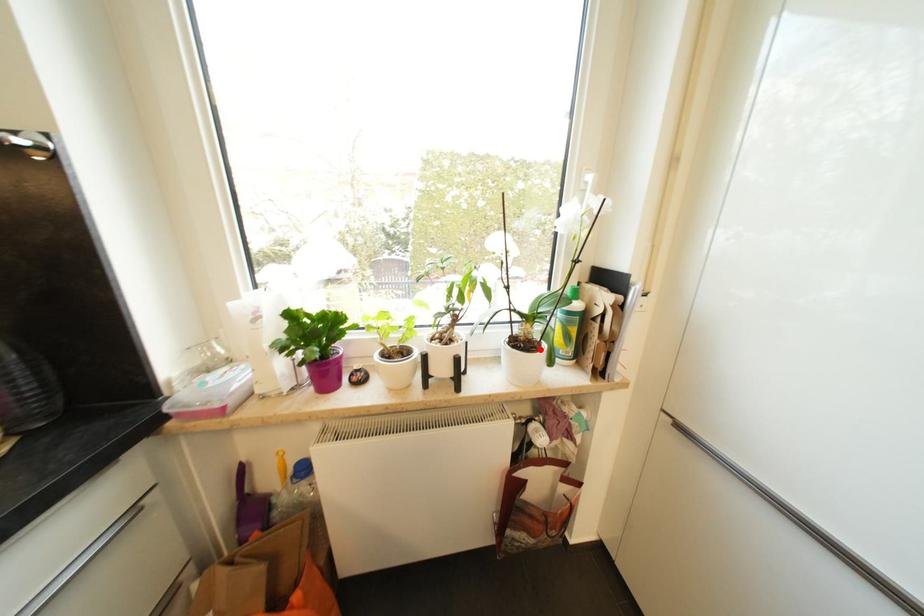
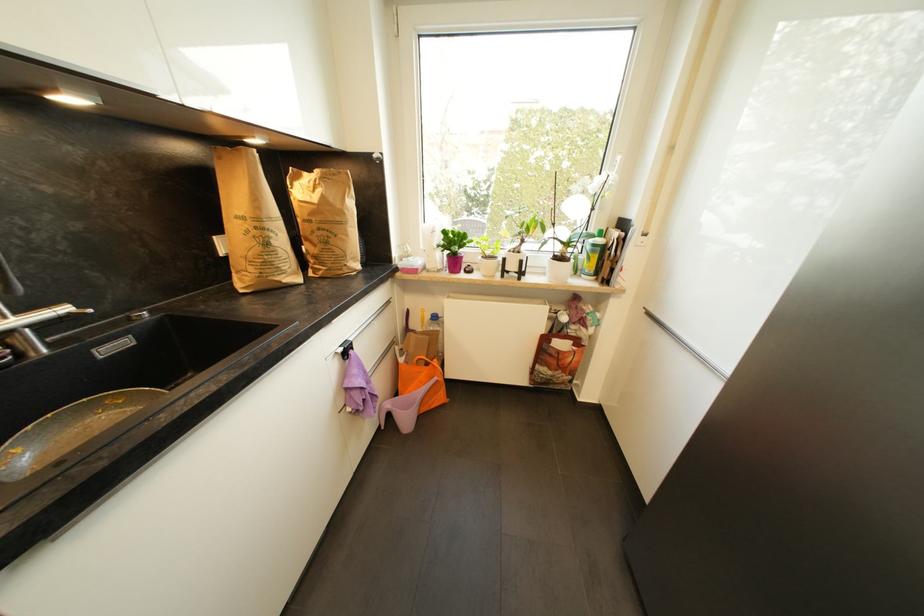
Question: I am providing you with two images of the same scene from different viewpoints. Given a red point in image1, look at the same physical point in image2. Is it:

Choices:
 (A) Closer to the viewpoint
 (B) Farther from the viewpoint

Answer: (A)